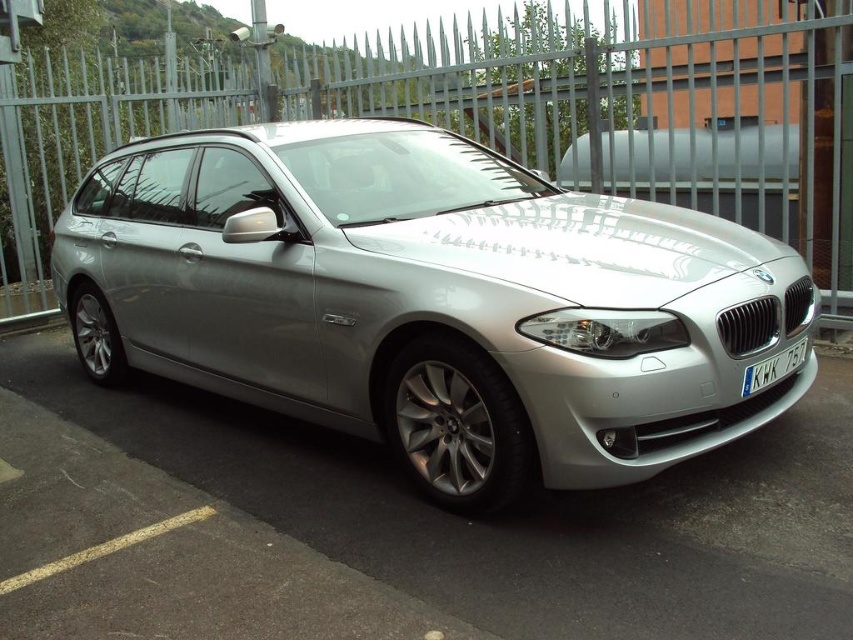
Is satin silver car at center closer to camera compared to metallic gray fence at center?

Yes, satin silver car at center is in front of metallic gray fence at center.

Between point (479, 292) and point (521, 20), which one is positioned in front?

Point (479, 292) is in front.

The width and height of the screenshot is (853, 640). Identify the location of satin silver car at center. (430, 301).

Which is more to the left, satin silver car at center or silver metallic car at center?

satin silver car at center

Does satin silver car at center have a smaller size compared to silver metallic car at center?

No.

Measure the distance between point (473, 435) and camera.

Point (473, 435) and camera are 1.82 meters apart.

Where is `satin silver car at center`? This screenshot has width=853, height=640. satin silver car at center is located at coordinates (430, 301).

Who is shorter, satin silver car at center or white plastic license plate at front?

With less height is white plastic license plate at front.

Is satin silver car at center smaller than white plastic license plate at front?

Actually, satin silver car at center might be larger than white plastic license plate at front.

This screenshot has width=853, height=640. I want to click on satin silver car at center, so click(430, 301).

Where is `satin silver car at center`? The width and height of the screenshot is (853, 640). satin silver car at center is located at coordinates (430, 301).